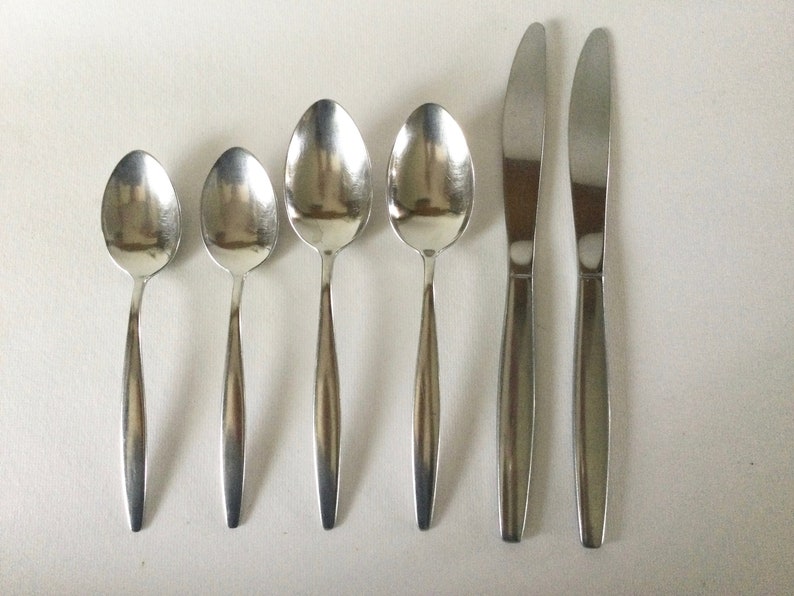
Find the location of `spoons`. spoons is located at coordinates (411, 180), (341, 179), (241, 221), (145, 232).